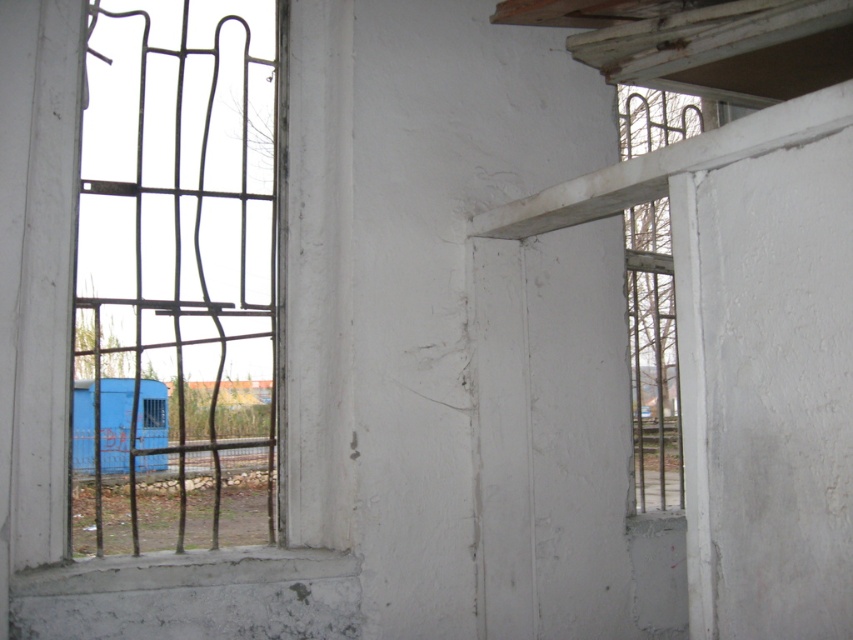
Who is positioned more to the right, metallic wire mesh at left or white concrete window sill at lower left?

white concrete window sill at lower left is more to the right.

What are the coordinates of `metallic wire mesh at left` in the screenshot? It's located at (36, 269).

Between point (306, 364) and point (42, 584), which one is positioned in front?

Positioned in front is point (42, 584).

Image resolution: width=853 pixels, height=640 pixels. What are the coordinates of `metallic wire mesh at left` in the screenshot? It's located at (36, 269).